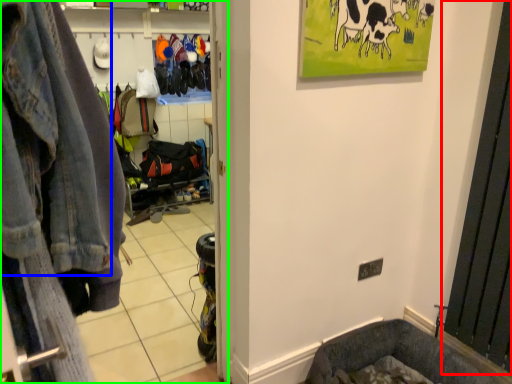
Question: Based on their relative distances, which object is nearer to screen door (highlighted by a red box)? Choose from denim jacket (highlighted by a blue box) and clothing store (highlighted by a green box).

Choices:
 (A) denim jacket
 (B) clothing store

Answer: (B)